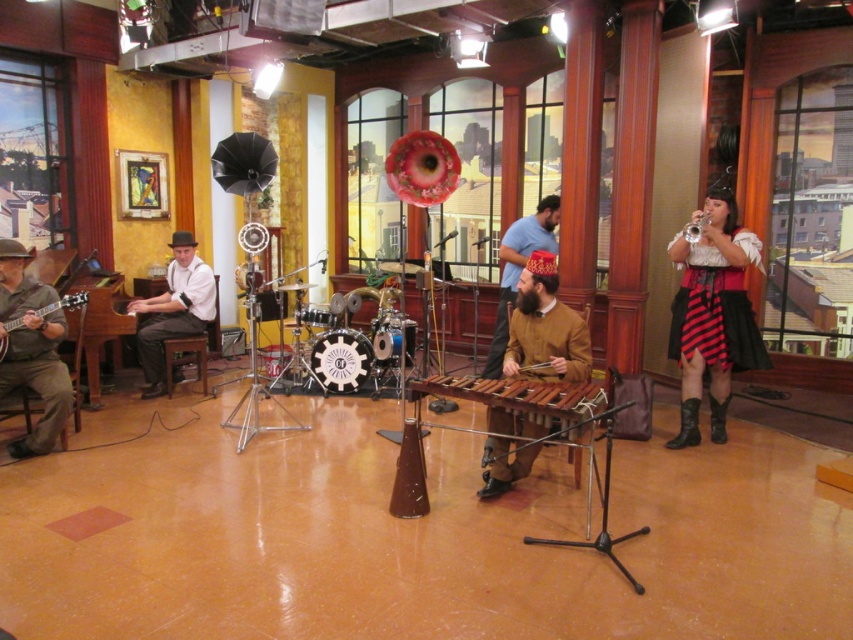
Can you confirm if brown leather jacket at center is positioned to the left of wooden marimba at center?

Incorrect, brown leather jacket at center is not on the left side of wooden marimba at center.

The image size is (853, 640). I want to click on brown leather jacket at center, so click(x=544, y=328).

This screenshot has width=853, height=640. Describe the element at coordinates (544, 328) in the screenshot. I see `brown leather jacket at center` at that location.

Identify the location of brown leather jacket at center. Image resolution: width=853 pixels, height=640 pixels. (544, 328).

Is striped skirt at right shorter than wooden marimba at center?

No, striped skirt at right is not shorter than wooden marimba at center.

Can you confirm if striped skirt at right is taller than wooden marimba at center?

A: Yes.

The image size is (853, 640). I want to click on striped skirt at right, so click(x=712, y=316).

You are a GUI agent. You are given a task and a screenshot of the screen. Output one action in this format:
    pyautogui.click(x=<x>, y=<y>)
    Task: Click on the striped skirt at right
    The width and height of the screenshot is (853, 640).
    Given the screenshot: What is the action you would take?
    pyautogui.click(x=712, y=316)

Is matte brown guitar at left to the right of matte white shirt at left from the viewer's perspective?

In fact, matte brown guitar at left is to the left of matte white shirt at left.

Is point (20, 304) positioned after point (160, 310)?

No, (20, 304) is closer to viewer.

The height and width of the screenshot is (640, 853). I want to click on matte brown guitar at left, so click(32, 349).

I want to click on matte brown guitar at left, so click(x=32, y=349).